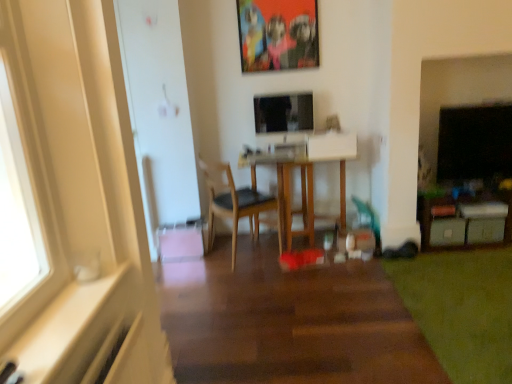
Locate an element on the screen. space that is in front of wooden table at center is located at coordinates (307, 281).